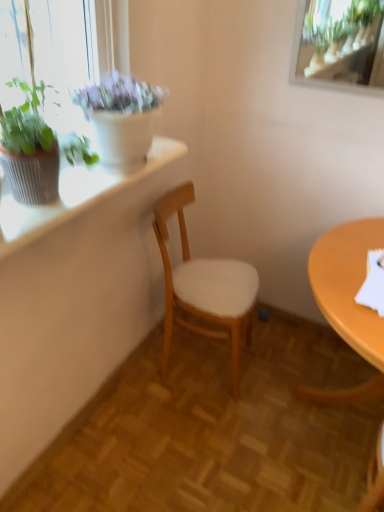
Question: From a real-world perspective, does green leafy plant at upper left, placed as the 1th houseplant when sorted from front to back, stand above white woven wood chair at center?

Choices:
 (A) no
 (B) yes

Answer: (B)

Question: Is green leafy plant at upper left, which is counted as the 2th houseplant, starting from the back, smaller than white woven wood chair at center?

Choices:
 (A) no
 (B) yes

Answer: (B)

Question: Can you confirm if green leafy plant at upper left, which is counted as the 2th houseplant, starting from the back, is bigger than white woven wood chair at center?

Choices:
 (A) yes
 (B) no

Answer: (B)

Question: From the image's perspective, is green leafy plant at upper left, which is counted as the 2th houseplant, starting from the back, beneath white woven wood chair at center?

Choices:
 (A) no
 (B) yes

Answer: (A)

Question: Considering the relative sizes of green leafy plant at upper left, placed as the 1th houseplant when sorted from front to back, and white woven wood chair at center in the image provided, is green leafy plant at upper left, placed as the 1th houseplant when sorted from front to back, wider than white woven wood chair at center?

Choices:
 (A) yes
 (B) no

Answer: (B)

Question: From the image's perspective, is matte white pot at upper left, the 2th houseplant in the front-to-back sequence, above or below white woven wood chair at center?

Choices:
 (A) below
 (B) above

Answer: (B)

Question: In the image, is matte white pot at upper left, the 1th houseplant in the back-to-front sequence, positioned in front of or behind white woven wood chair at center?

Choices:
 (A) front
 (B) behind

Answer: (A)

Question: Is matte white pot at upper left, the 2th houseplant in the front-to-back sequence, taller or shorter than white woven wood chair at center?

Choices:
 (A) tall
 (B) short

Answer: (B)

Question: Does point (129, 161) appear closer or farther from the camera than point (200, 274)?

Choices:
 (A) closer
 (B) farther

Answer: (A)

Question: Is textured white window sill at upper left to the left or to the right of green leafy plant at upper left, placed as the 1th houseplant when sorted from front to back, in the image?

Choices:
 (A) right
 (B) left

Answer: (A)

Question: Is textured white window sill at upper left taller or shorter than green leafy plant at upper left, placed as the 1th houseplant when sorted from front to back?

Choices:
 (A) short
 (B) tall

Answer: (A)

Question: In terms of size, does textured white window sill at upper left appear bigger or smaller than green leafy plant at upper left, placed as the 1th houseplant when sorted from front to back?

Choices:
 (A) big
 (B) small

Answer: (B)

Question: From the image's perspective, is textured white window sill at upper left above or below green leafy plant at upper left, placed as the 1th houseplant when sorted from front to back?

Choices:
 (A) below
 (B) above

Answer: (A)

Question: In the image, is matte white pot at upper left, the 2th houseplant in the front-to-back sequence, positioned in front of or behind green leafy plant at upper left, which is counted as the 2th houseplant, starting from the back?

Choices:
 (A) front
 (B) behind

Answer: (B)

Question: Is matte white pot at upper left, the 2th houseplant in the front-to-back sequence, inside or outside of green leafy plant at upper left, placed as the 1th houseplant when sorted from front to back?

Choices:
 (A) outside
 (B) inside

Answer: (A)